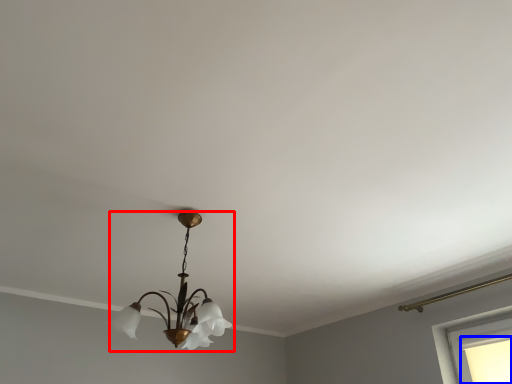
Question: Which object is further to the camera taking this photo, lamp (highlighted by a red box) or window (highlighted by a blue box)?

Choices:
 (A) lamp
 (B) window

Answer: (B)